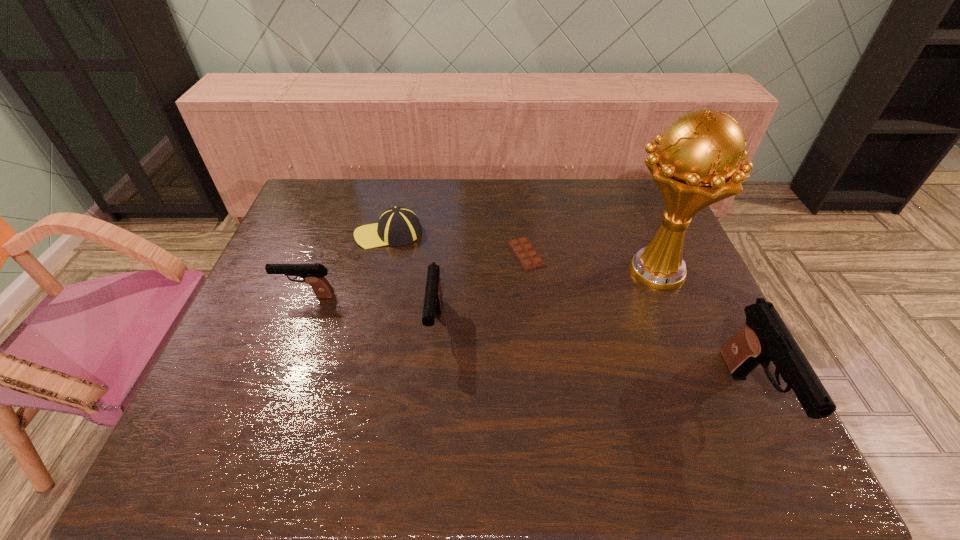
Where is `vacant area that satisfies the following two spatial constraints: 1. with the brim of the fifth object from right to left facing forward; 2. on the right side of the shortest object`? This screenshot has height=540, width=960. vacant area that satisfies the following two spatial constraints: 1. with the brim of the fifth object from right to left facing forward; 2. on the right side of the shortest object is located at coordinates (384, 254).